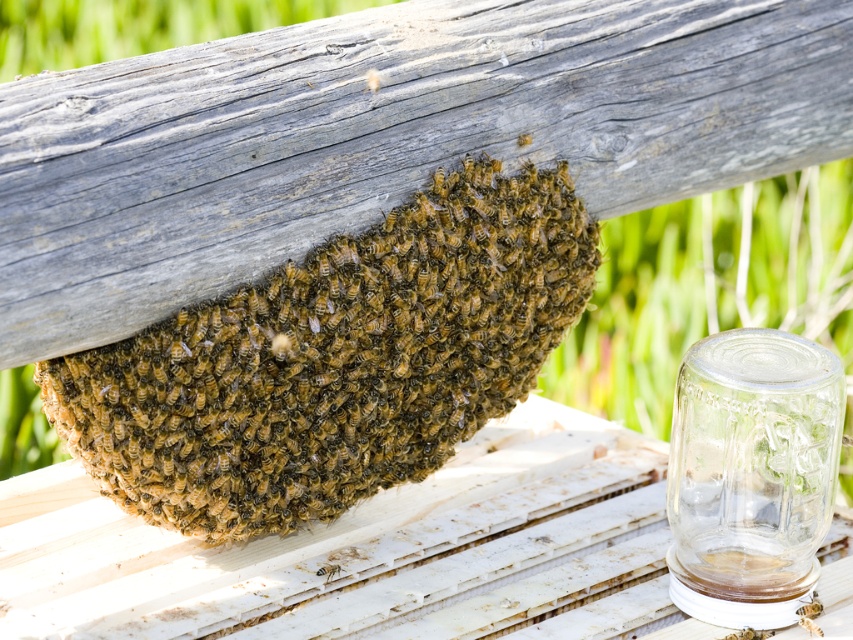
This screenshot has width=853, height=640. Describe the element at coordinates (335, 360) in the screenshot. I see `brown fuzzy beehive at center` at that location.

Locate an element on the screen. brown fuzzy beehive at center is located at coordinates (335, 360).

Between brown fuzzy beehive at center and translucent yellowish honeycomb at lower center, which one is positioned lower?

translucent yellowish honeycomb at lower center is below.

Can you confirm if brown fuzzy beehive at center is shorter than translucent yellowish honeycomb at lower center?

Incorrect, brown fuzzy beehive at center's height does not fall short of translucent yellowish honeycomb at lower center's.

Find the location of a particular element. This screenshot has width=853, height=640. brown fuzzy beehive at center is located at coordinates (335, 360).

Can you confirm if clear glass jar at right is thinner than translucent yellowish honeycomb at lower center?

No, clear glass jar at right is not thinner than translucent yellowish honeycomb at lower center.

Can you confirm if clear glass jar at right is positioned to the right of translucent yellowish honeycomb at lower center?

Yes, clear glass jar at right is to the right of translucent yellowish honeycomb at lower center.

Measure the distance between point [747,593] and camera.

The distance of point [747,593] from camera is 14.31 inches.

Find the location of a particular element. The width and height of the screenshot is (853, 640). clear glass jar at right is located at coordinates (751, 474).